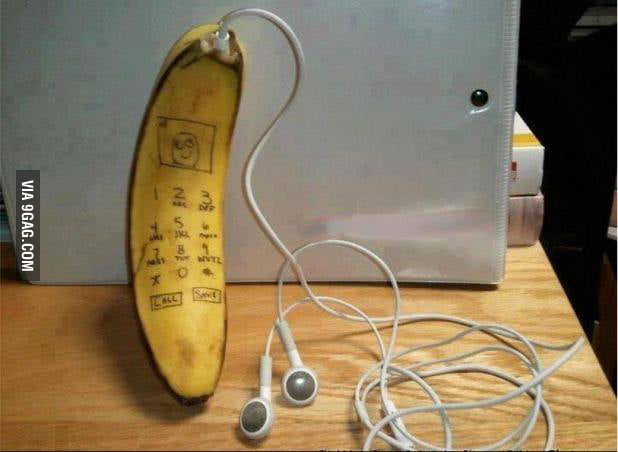
What are the coordinates of `grain lines in table` in the screenshot? It's located at (548, 318), (542, 295), (535, 280), (534, 265), (528, 260).